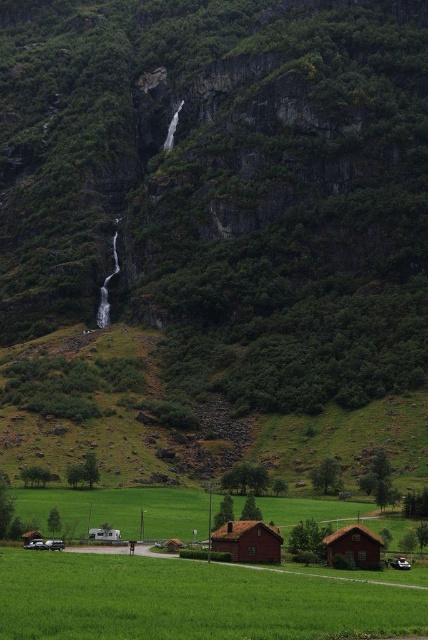
Can you confirm if matte red wooden hut at center is positioned above brown wooden hut at lower right?

Yes, matte red wooden hut at center is above brown wooden hut at lower right.

In the scene shown: Measure the distance from matte red wooden hut at center to brown wooden hut at lower right.

matte red wooden hut at center is 4.94 meters from brown wooden hut at lower right.

Does point (275, 540) come in front of point (372, 541)?

No, (275, 540) is further to viewer.

The width and height of the screenshot is (428, 640). In order to click on matte red wooden hut at center in this screenshot , I will do `click(247, 541)`.

Who is more distant from viewer, (29, 577) or (279, 561)?

Positioned behind is point (279, 561).

Who is positioned more to the left, green grass field at lower center or matte red wooden hut at center?

green grass field at lower center is more to the left.

Find the location of a particular element. green grass field at lower center is located at coordinates (192, 600).

The height and width of the screenshot is (640, 428). I want to click on green grass field at lower center, so click(x=192, y=600).

Is the position of green grass field at lower center less distant than that of brown wooden hut at lower right?

Yes, it is.

Between green grass field at lower center and brown wooden hut at lower right, which one appears on the right side from the viewer's perspective?

From the viewer's perspective, brown wooden hut at lower right appears more on the right side.

I want to click on green grass field at lower center, so click(x=192, y=600).